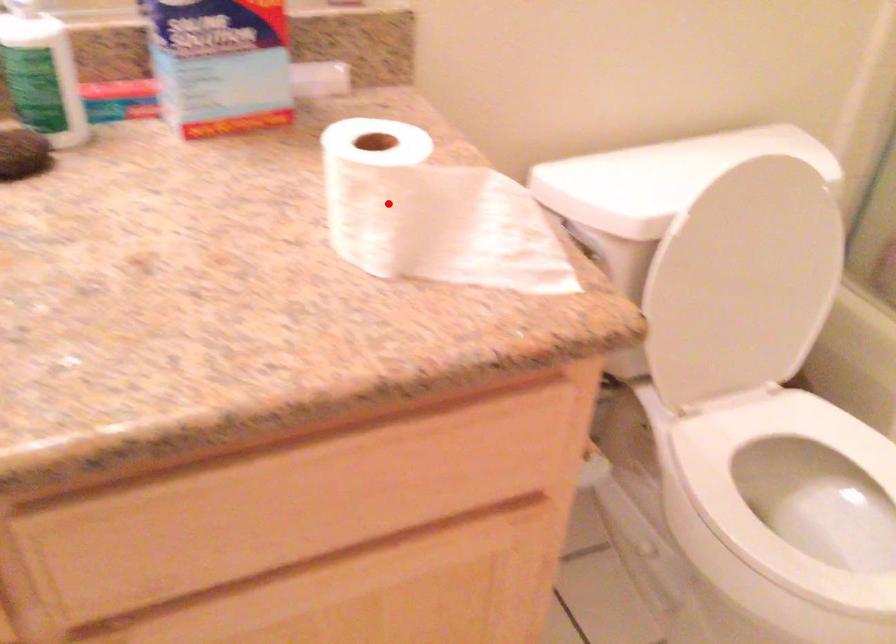
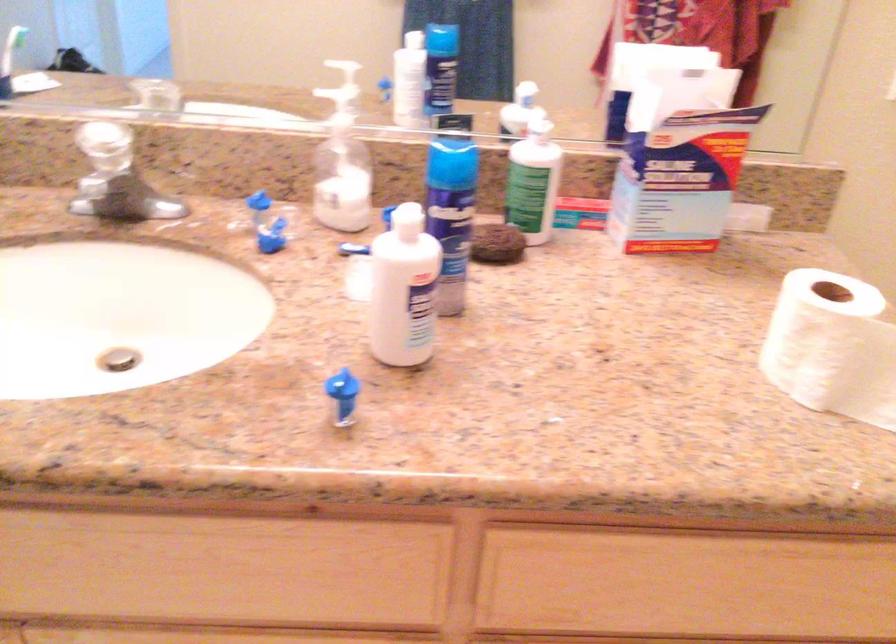
Question: I am providing you with two images of the same scene from different viewpoints. A red point is shown in image1. For the corresponding object point in image2, is it positioned nearer or farther from the camera?

Choices:
 (A) Nearer
 (B) Farther

Answer: (B)